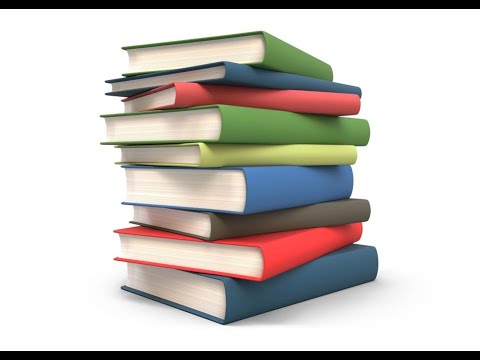
Find the location of a particular element. The height and width of the screenshot is (360, 480). book is located at coordinates (211, 300), (238, 260), (218, 225), (231, 192), (206, 155), (202, 127), (173, 92), (214, 74), (232, 47).